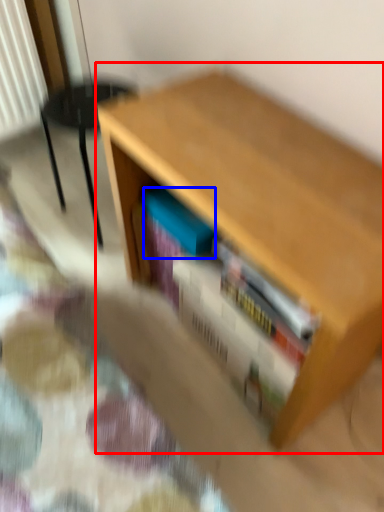
Question: Which of the following is the closest to the observer, table (highlighted by a red box) or paperback book (highlighted by a blue box)?

Choices:
 (A) table
 (B) paperback book

Answer: (A)